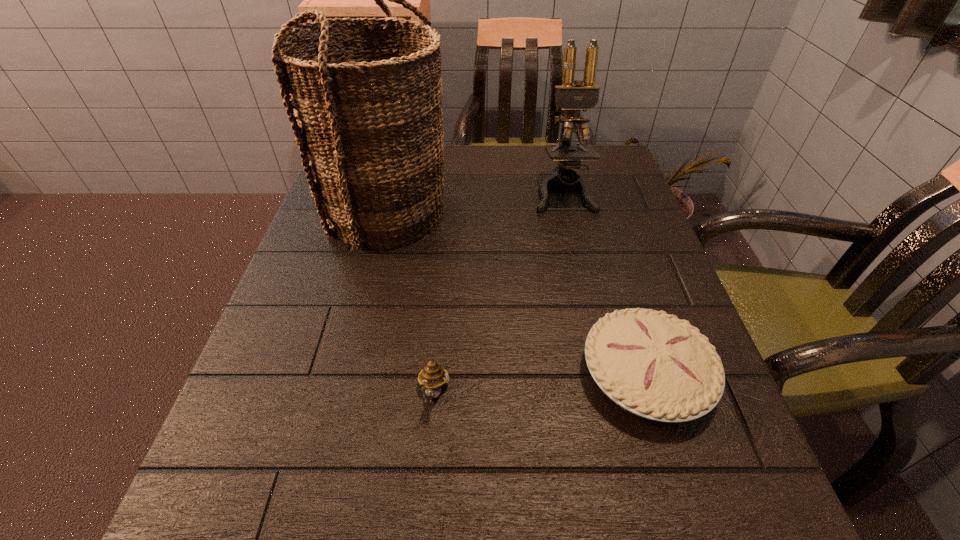
The height and width of the screenshot is (540, 960). Find the location of `vacant space that is in between the microscope and the shortest object`. vacant space that is in between the microscope and the shortest object is located at coordinates (605, 284).

Locate an element on the screen. Image resolution: width=960 pixels, height=540 pixels. free space that is in between the third tallest object and the pie is located at coordinates (540, 384).

The height and width of the screenshot is (540, 960). What are the coordinates of `vacant space that's between the snail and the pie` in the screenshot? It's located at (540, 384).

You are a GUI agent. You are given a task and a screenshot of the screen. Output one action in this format:
    pyautogui.click(x=<x>, y=<y>)
    Task: Click on the vacant area between the basket and the pie
    This screenshot has width=960, height=540.
    Given the screenshot: What is the action you would take?
    pyautogui.click(x=516, y=294)

In order to click on vacant area that lies between the tallest object and the pie in this screenshot , I will do `click(516, 294)`.

I want to click on vacant area that lies between the shortest object and the second shortest object, so click(x=540, y=384).

Locate an element on the screen. The width and height of the screenshot is (960, 540). free point between the third shortest object and the snail is located at coordinates (498, 293).

What are the coordinates of `free point between the pie and the microscope` in the screenshot? It's located at (605, 284).

Locate an element on the screen. Image resolution: width=960 pixels, height=540 pixels. free space between the microscope and the shortest object is located at coordinates (605, 284).

At what (x,y) coordinates should I click in order to perform the action: click on free space between the microscope and the basket. Please return your answer as a coordinate pair (x, y). The height and width of the screenshot is (540, 960). Looking at the image, I should click on (475, 202).